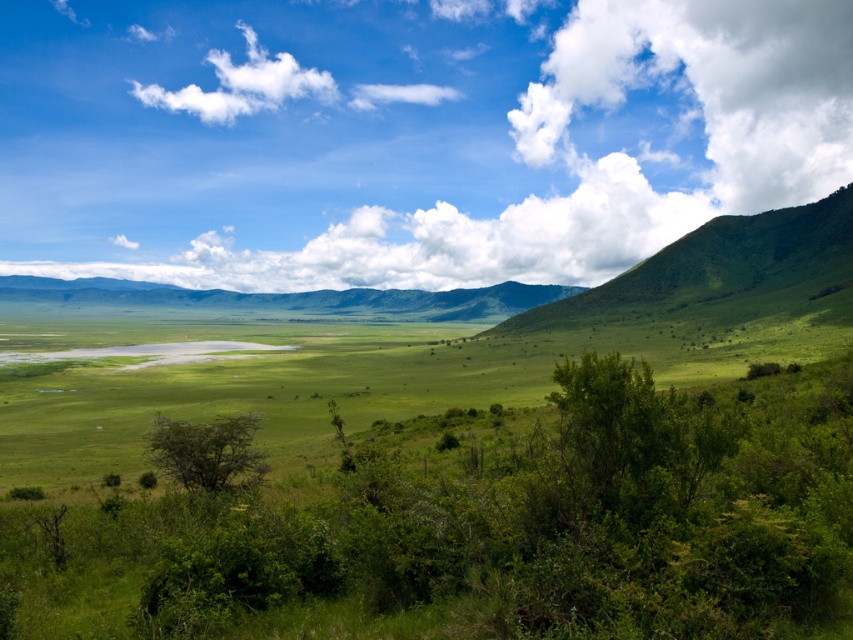
In the scene shown: You are planning to take a photo of the landscape. You want to ensure that both the green leafy shrubs at center and the white fluffy cloud at upper right are clearly visible. Given their sizes, which object might appear smaller in the photo?

The green leafy shrubs at center appear smaller in the photo because their width is less than the white fluffy cloud at upper right.

You are an airplane passenger looking out the window and see two white fluffy clouds. The first is the white fluffy cloud at upper center and the second is the white fluffy cloud at upper right. Which cloud appears closer to you?

The white fluffy cloud at upper center appears closer to you because it is closer to the viewer than the white fluffy cloud at upper right according to the scene description.